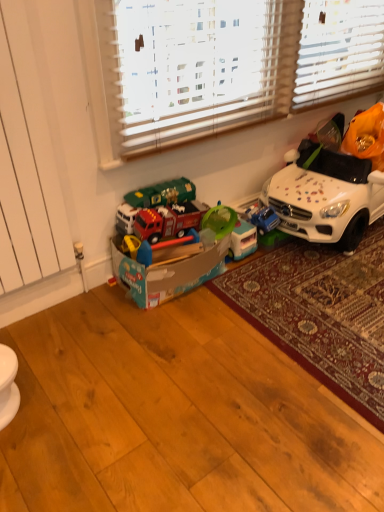
Locate an element on the screen. free space in front of blue plastic toy car at center, arranged as the third toy when viewed from the left is located at coordinates (261, 267).